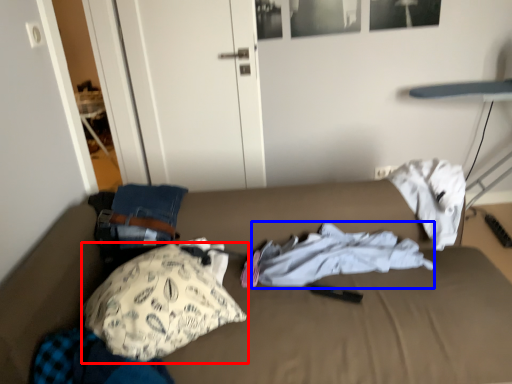
Question: Which object is further to the camera taking this photo, pillow (highlighted by a red box) or clothing (highlighted by a blue box)?

Choices:
 (A) pillow
 (B) clothing

Answer: (B)